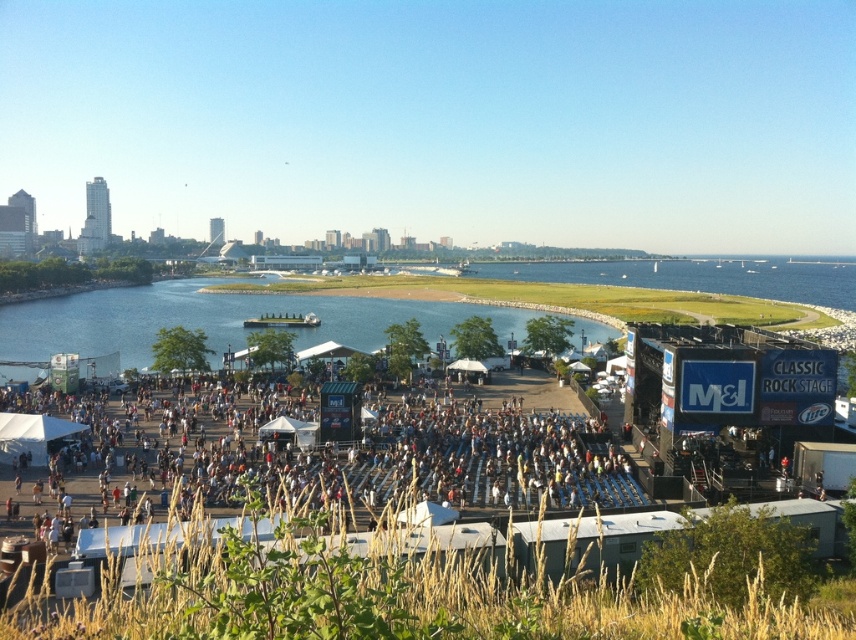
Question: Considering the relative positions of white fabric tent at center and blue water at center in the image provided, where is white fabric tent at center located with respect to blue water at center?

Choices:
 (A) above
 (B) below

Answer: (B)

Question: Which object appears farthest from the camera in this image?

Choices:
 (A) blue water at center
 (B) white fabric tent at center

Answer: (A)

Question: Can you confirm if white fabric tent at center is smaller than blue water at center?

Choices:
 (A) no
 (B) yes

Answer: (B)

Question: Can you confirm if white fabric tent at center is bigger than blue water at center?

Choices:
 (A) yes
 (B) no

Answer: (B)